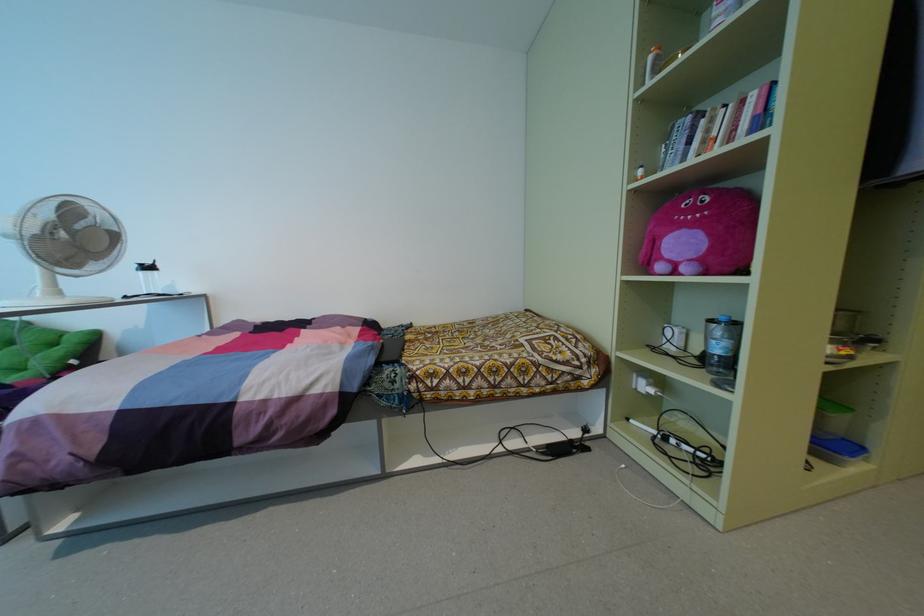
What are the coordinates of `book` in the screenshot? It's located at (748, 113).